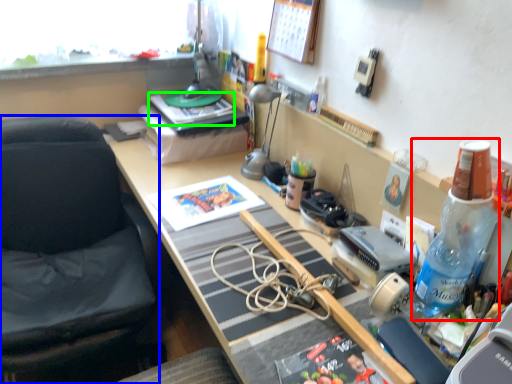
Question: Which is nearer to the bottle (highlighted by a red box)? chair (highlighted by a blue box) or book (highlighted by a green box).

Choices:
 (A) chair
 (B) book

Answer: (B)